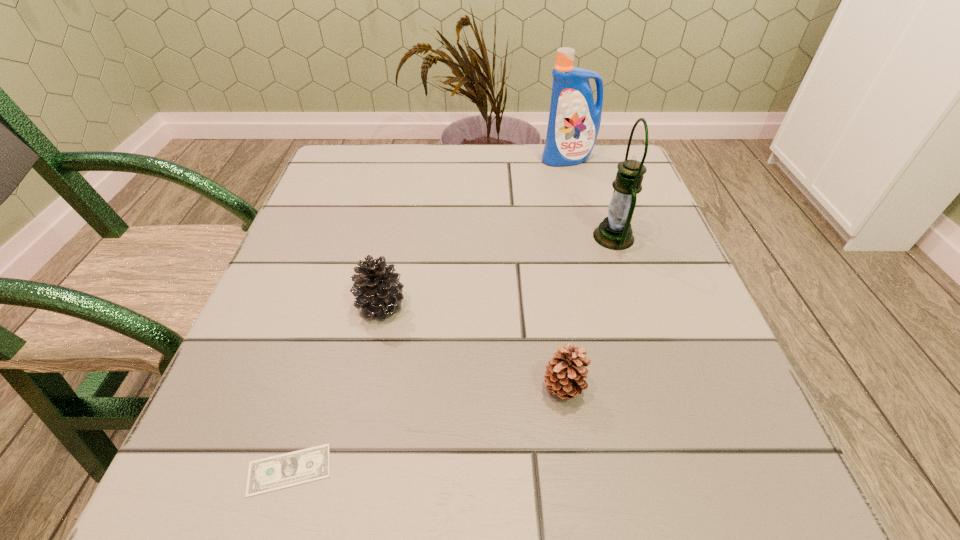
Where is `empty space between the farthest object and the farther pinecone`? Image resolution: width=960 pixels, height=540 pixels. empty space between the farthest object and the farther pinecone is located at coordinates (474, 233).

In order to click on free space between the right pinecone and the nearest object in this screenshot , I will do `click(426, 429)`.

I want to click on free space that is in between the nearer pinecone and the shortest object, so click(x=426, y=429).

In order to click on vacant space that's between the taller pinecone and the farthest object in this screenshot , I will do `click(474, 233)`.

Locate an element on the screen. vacant space that's between the fourth farthest object and the nearest object is located at coordinates (426, 429).

This screenshot has width=960, height=540. Identify the location of free spot between the money and the third tallest object. (335, 388).

The width and height of the screenshot is (960, 540). I want to click on free area in between the third object from left to right and the lantern, so click(588, 313).

Find the location of a particular element. This screenshot has height=540, width=960. vacant space in between the farthest object and the lantern is located at coordinates (590, 198).

The image size is (960, 540). I want to click on free space between the third tallest object and the shortest object, so click(x=335, y=388).

You are a GUI agent. You are given a task and a screenshot of the screen. Output one action in this format:
    pyautogui.click(x=<x>, y=<y>)
    Task: Click on the unoccupied position between the fourth nearest object and the second shortest object
    Image resolution: width=960 pixels, height=540 pixels.
    Given the screenshot: What is the action you would take?
    pyautogui.click(x=588, y=313)